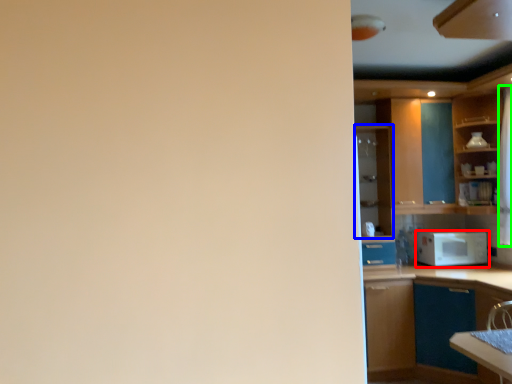
Question: Estimate the real-world distances between objects in this image. Which object is farther from microwave oven (highlighted by a red box), cabinetry (highlighted by a blue box) or curtain (highlighted by a green box)?

Choices:
 (A) cabinetry
 (B) curtain

Answer: (A)